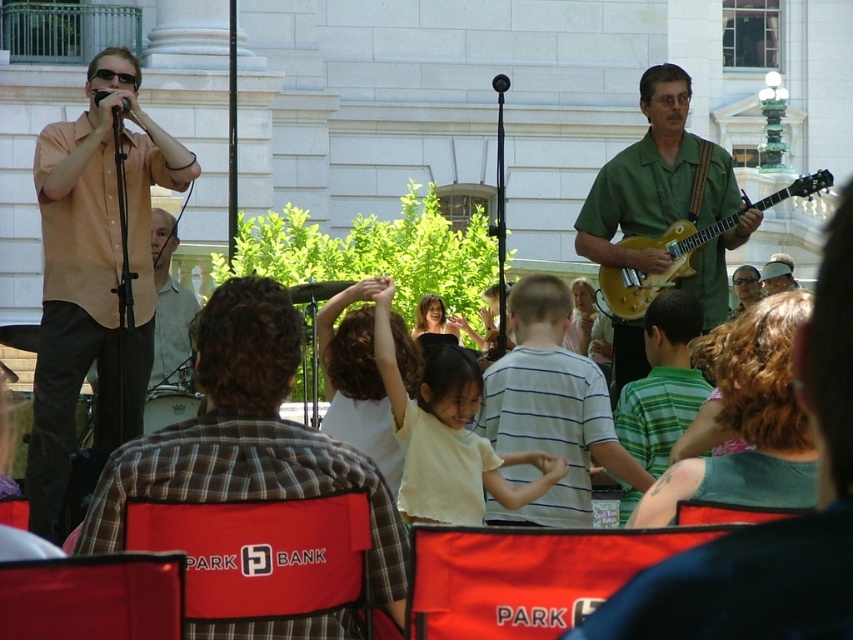
Who is positioned more to the right, plaid shirt at center or green matte guitar at center?

Positioned to the right is green matte guitar at center.

Locate an element on the screen. This screenshot has width=853, height=640. plaid shirt at center is located at coordinates pyautogui.click(x=247, y=438).

Where is `plaid shirt at center`? The image size is (853, 640). plaid shirt at center is located at coordinates coord(247,438).

Is green matte guitar at center smaller than matte green shirt at center?

Incorrect, green matte guitar at center is not smaller in size than matte green shirt at center.

Who is positioned more to the left, green matte guitar at center or matte green shirt at center?

Positioned to the left is green matte guitar at center.

Where is `green matte guitar at center`? green matte guitar at center is located at coordinates (654, 179).

Between point (137, 65) and point (241, 291), which one is positioned in front?

Point (241, 291)

Is point (57, 477) closer to camera compared to point (219, 394)?

No.

Does point (80, 154) come farther from viewer compared to point (322, 480)?

Yes.

Locate an element on the screen. matte peach shirt at left is located at coordinates coord(94,275).